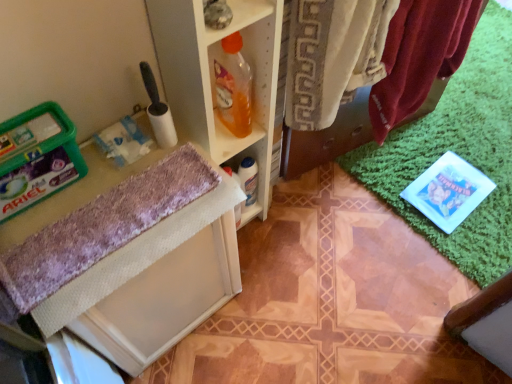
Find the location of a particular element. velvet-like red towel at upper right is located at coordinates (326, 139).

Where is `purple fuzzy bath towel at lower left`? purple fuzzy bath towel at lower left is located at coordinates coord(101,228).

Looking at this image, would you consider velvet-like red towel at upper right to be distant from purple fuzzy bath towel at lower left?

Actually, velvet-like red towel at upper right and purple fuzzy bath towel at lower left are a little close together.

Which object is closer to the camera, velvet-like red towel at upper right or purple fuzzy bath towel at lower left?

purple fuzzy bath towel at lower left is in front.

Could you tell me if velvet-like red towel at upper right is facing purple fuzzy bath towel at lower left?

No, velvet-like red towel at upper right does not turn towards purple fuzzy bath towel at lower left.

From their relative heights in the image, would you say velvet-like red towel at upper right is taller or shorter than purple fuzzy bath towel at lower left?

Clearly, velvet-like red towel at upper right is taller compared to purple fuzzy bath towel at lower left.

Which of these two, translucent orange liquid at shelf center or purple fuzzy bath towel at lower left, is bigger?

purple fuzzy bath towel at lower left is bigger.

From the picture: Is translucent orange liquid at shelf center wider or thinner than purple fuzzy bath towel at lower left?

In the image, translucent orange liquid at shelf center appears to be more narrow than purple fuzzy bath towel at lower left.

Which is in front, point (247, 126) or point (143, 223)?

The point (143, 223) is more forward.

Which object is further away from the camera taking this photo, translucent orange liquid at shelf center or purple fuzzy bath towel at lower left?

Positioned behind is translucent orange liquid at shelf center.

Can you confirm if purple fuzzy bath towel at lower left is shorter than velvet-like red towel at upper right?

Yes.

Is purple fuzzy bath towel at lower left bigger or smaller than velvet-like red towel at upper right?

Considering their sizes, purple fuzzy bath towel at lower left takes up less space than velvet-like red towel at upper right.

Can you confirm if purple fuzzy bath towel at lower left is wider than velvet-like red towel at upper right?

No.

Is purple fuzzy bath towel at lower left oriented away from velvet-like red towel at upper right?

No, velvet-like red towel at upper right is not at the back of purple fuzzy bath towel at lower left.

Relative to translucent orange liquid at shelf center, is purple fuzzy bath towel at lower left in front or behind?

In the image, purple fuzzy bath towel at lower left appears in front of translucent orange liquid at shelf center.

Based on the photo, in the image, is purple fuzzy bath towel at lower left on the left side or the right side of translucent orange liquid at shelf center?

Based on their positions, purple fuzzy bath towel at lower left is located to the left of translucent orange liquid at shelf center.

Is purple fuzzy bath towel at lower left oriented towards translucent orange liquid at shelf center?

No, purple fuzzy bath towel at lower left does not turn towards translucent orange liquid at shelf center.

From the image's perspective, which is above, purple fuzzy bath towel at lower left or translucent orange liquid at shelf center?

translucent orange liquid at shelf center, from the image's perspective.

Is translucent orange liquid at shelf center closer to camera compared to velvet-like red towel at upper right?

That is False.

Does translucent orange liquid at shelf center have a smaller size compared to velvet-like red towel at upper right?

Correct, translucent orange liquid at shelf center occupies less space than velvet-like red towel at upper right.

Is translucent orange liquid at shelf center spatially inside velvet-like red towel at upper right, or outside of it?

translucent orange liquid at shelf center lies outside velvet-like red towel at upper right.

In terms of width, does translucent orange liquid at shelf center look wider or thinner when compared to velvet-like red towel at upper right?

translucent orange liquid at shelf center is thinner than velvet-like red towel at upper right.

Does velvet-like red towel at upper right have a smaller size compared to translucent orange liquid at shelf center?

No, velvet-like red towel at upper right is not smaller than translucent orange liquid at shelf center.

Is velvet-like red towel at upper right positioned far away from translucent orange liquid at shelf center?

No, velvet-like red towel at upper right is not far from translucent orange liquid at shelf center.

Would you say velvet-like red towel at upper right is to the left or to the right of translucent orange liquid at shelf center in the picture?

Based on their positions, velvet-like red towel at upper right is located to the right of translucent orange liquid at shelf center.

Where is `laundry above the purple fuzzy bath towel at lower left (from the image's perspective)`? The width and height of the screenshot is (512, 384). laundry above the purple fuzzy bath towel at lower left (from the image's perspective) is located at coordinates (326, 139).

This screenshot has width=512, height=384. Identify the location of bath towel below the translucent orange liquid at shelf center (from the image's perspective). (101, 228).

Which object lies further to the anchor point translucent orange liquid at shelf center, velvet-like red towel at upper right or purple fuzzy bath towel at lower left?

velvet-like red towel at upper right is further to translucent orange liquid at shelf center.

From the image, which object appears to be nearer to translucent orange liquid at shelf center, purple fuzzy bath towel at lower left or velvet-like red towel at upper right?

purple fuzzy bath towel at lower left is positioned closer to the anchor translucent orange liquid at shelf center.

When comparing their distances from purple fuzzy bath towel at lower left, does velvet-like red towel at upper right or translucent orange liquid at shelf center seem further?

Based on the image, velvet-like red towel at upper right appears to be further to purple fuzzy bath towel at lower left.

Estimate the real-world distances between objects in this image. Which object is closer to velvet-like red towel at upper right, translucent orange liquid at shelf center or purple fuzzy bath towel at lower left?

translucent orange liquid at shelf center lies closer to velvet-like red towel at upper right than the other object.

Looking at the image, which one is located closer to purple fuzzy bath towel at lower left, translucent orange liquid at shelf center or velvet-like red towel at upper right?

translucent orange liquid at shelf center is closer to purple fuzzy bath towel at lower left.

Considering their positions, is purple fuzzy bath towel at lower left positioned closer to velvet-like red towel at upper right than translucent orange liquid at shelf center?

Among the two, translucent orange liquid at shelf center is located nearer to velvet-like red towel at upper right.

You are a GUI agent. You are given a task and a screenshot of the screen. Output one action in this format:
    pyautogui.click(x=<x>, y=<y>)
    Task: Click on the bottle between purple fuzzy bath towel at lower left and velvet-like red towel at upper right
    The image size is (512, 384).
    Given the screenshot: What is the action you would take?
    pyautogui.click(x=233, y=87)